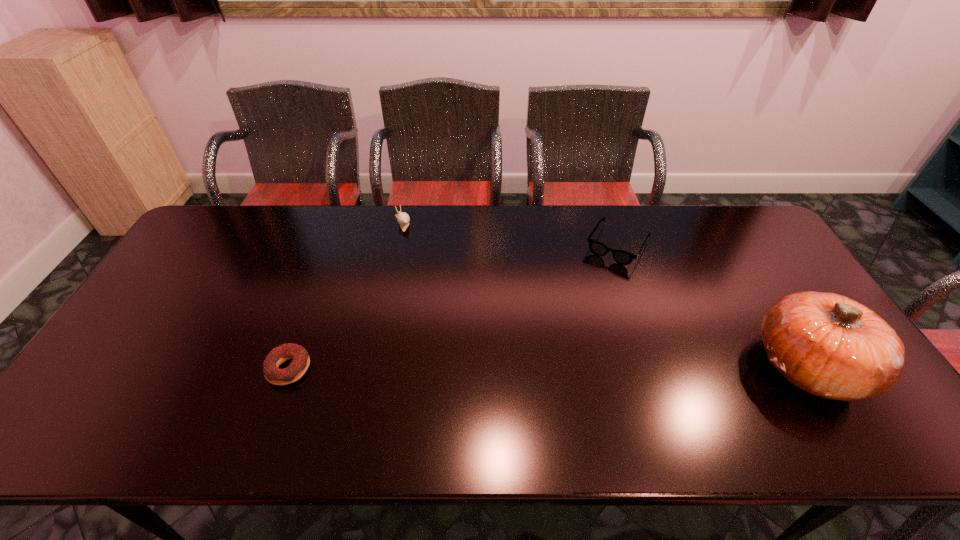
At what (x,y) coordinates should I click in order to perform the action: click on vacant space located 0.150m on the arms of the third object from left to right. Please return your answer as a coordinate pair (x, y). This screenshot has height=540, width=960. Looking at the image, I should click on (588, 295).

Where is `free location located 0.330m on the arms of the third object from left to right`? free location located 0.330m on the arms of the third object from left to right is located at coordinates (562, 338).

Locate an element on the screen. This screenshot has height=540, width=960. vacant area situated 0.290m on the arms of the third object from left to right is located at coordinates (568, 328).

You are a GUI agent. You are given a task and a screenshot of the screen. Output one action in this format:
    pyautogui.click(x=<x>, y=<y>)
    Task: Click on the escargot at the far edge
    This screenshot has width=960, height=540.
    Given the screenshot: What is the action you would take?
    pyautogui.click(x=403, y=219)

Where is `spectacles that is at the far edge`? The image size is (960, 540). spectacles that is at the far edge is located at coordinates (622, 257).

Locate an element on the screen. The width and height of the screenshot is (960, 540). doughnut present at the near edge is located at coordinates (300, 358).

The image size is (960, 540). I want to click on pumpkin that is at the near edge, so click(x=831, y=346).

At what (x,y) coordinates should I click in order to perform the action: click on object that is at the right edge. Please return your answer as a coordinate pair (x, y). This screenshot has width=960, height=540. Looking at the image, I should click on (831, 346).

What are the coordinates of `object located at the near right corner` in the screenshot? It's located at (831, 346).

The image size is (960, 540). I want to click on free location at the far edge of the desktop, so click(x=255, y=233).